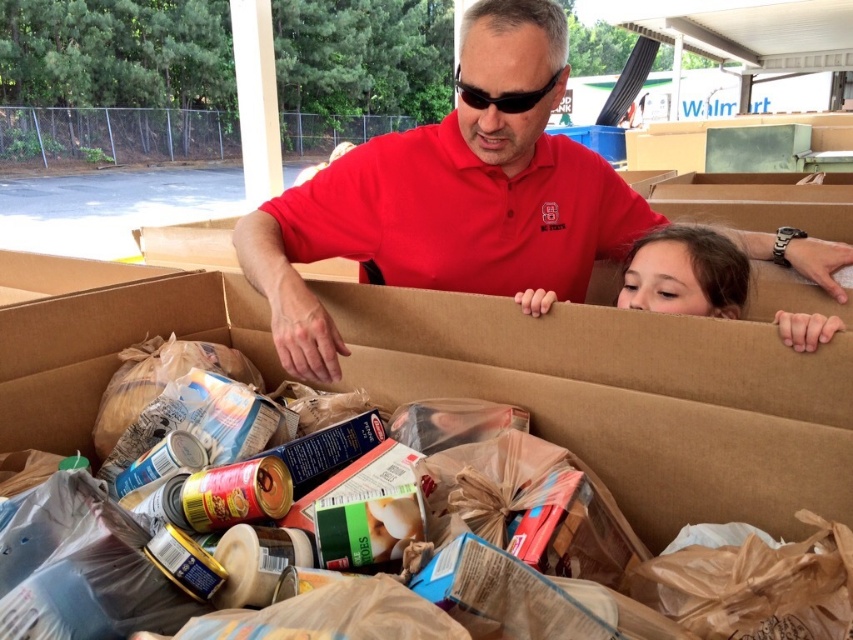
Question: Which point appears closest to the camera in this image?

Choices:
 (A) tap(727, 268)
 (B) tap(367, 152)
 (C) tap(666, 419)

Answer: (C)

Question: Based on their relative distances, which object is farther from the black plastic goggles at upper center?

Choices:
 (A) matte red shirt at center
 (B) brown cardboard box at center

Answer: (B)

Question: Considering the relative positions of smooth brown hair at upper right and black plastic goggles at upper center in the image provided, where is smooth brown hair at upper right located with respect to black plastic goggles at upper center?

Choices:
 (A) below
 (B) above

Answer: (A)

Question: Does brown cardboard box at center appear on the right side of smooth brown hair at upper right?

Choices:
 (A) no
 (B) yes

Answer: (A)

Question: Is matte red shirt at center to the left of black plastic goggles at upper center from the viewer's perspective?

Choices:
 (A) yes
 (B) no

Answer: (B)

Question: Considering the real-world distances, which object is closest to the black plastic goggles at upper center?

Choices:
 (A) smooth brown hair at upper right
 (B) matte red shirt at center

Answer: (B)